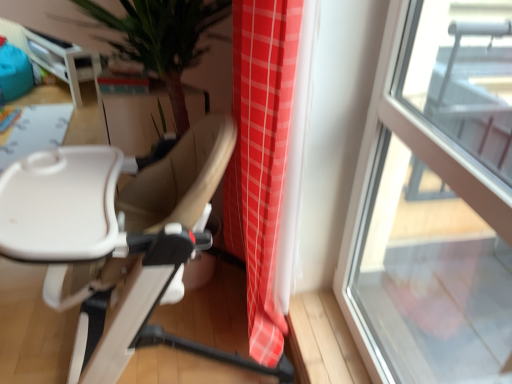
Question: Is there a large distance between white glossy table at upper left and beige leather chair at center?

Choices:
 (A) no
 (B) yes

Answer: (B)

Question: Could you tell me if white glossy table at upper left is turned towards beige leather chair at center?

Choices:
 (A) yes
 (B) no

Answer: (B)

Question: From the image's perspective, is white glossy table at upper left above beige leather chair at center?

Choices:
 (A) yes
 (B) no

Answer: (A)

Question: Is white glossy table at upper left not within beige leather chair at center?

Choices:
 (A) no
 (B) yes

Answer: (B)

Question: Can beige leather chair at center be found inside white glossy table at upper left?

Choices:
 (A) yes
 (B) no

Answer: (B)

Question: From a real-world perspective, is white glossy table at upper left below beige leather chair at center?

Choices:
 (A) yes
 (B) no

Answer: (B)

Question: Is transparent glass window at right positioned before white glossy table at upper left?

Choices:
 (A) no
 (B) yes

Answer: (B)

Question: Considering the relative sizes of transparent glass window at right and white glossy table at upper left in the image provided, is transparent glass window at right taller than white glossy table at upper left?

Choices:
 (A) no
 (B) yes

Answer: (B)

Question: From the image's perspective, is transparent glass window at right beneath white glossy table at upper left?

Choices:
 (A) yes
 (B) no

Answer: (A)

Question: Is transparent glass window at right next to white glossy table at upper left?

Choices:
 (A) yes
 (B) no

Answer: (B)

Question: Is transparent glass window at right behind white glossy table at upper left?

Choices:
 (A) yes
 (B) no

Answer: (B)

Question: Is white glossy table at upper left at the back of transparent glass window at right?

Choices:
 (A) no
 (B) yes

Answer: (A)

Question: Is white glossy table at upper left completely or partially outside of transparent glass window at right?

Choices:
 (A) no
 (B) yes

Answer: (B)